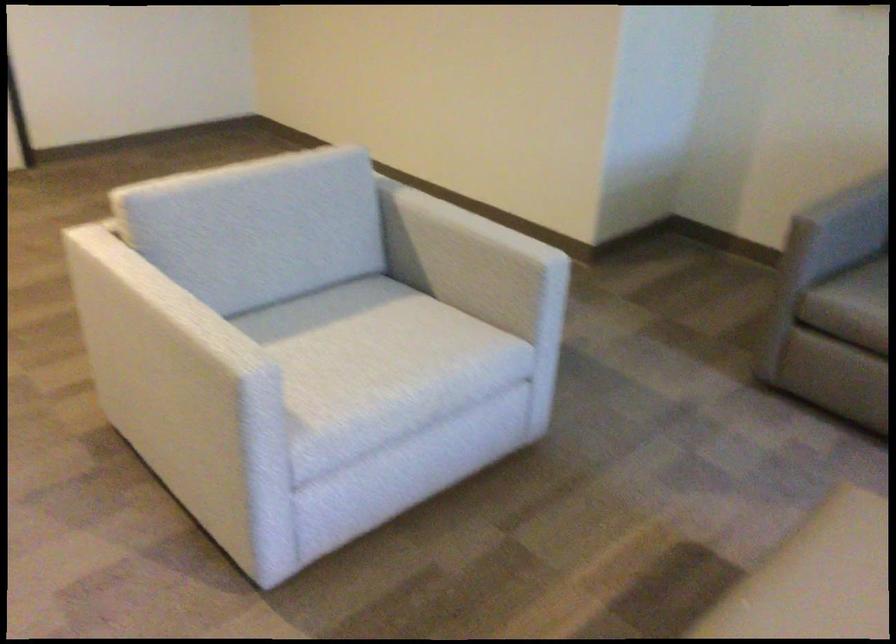
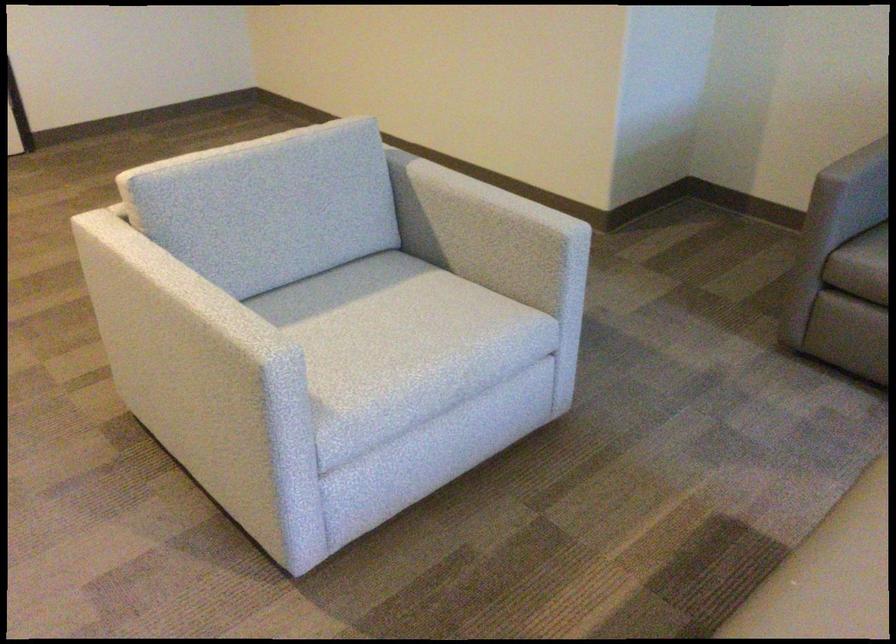
Find the pixel in the second image that matches pixel 177 304 in the first image.

(195, 294)